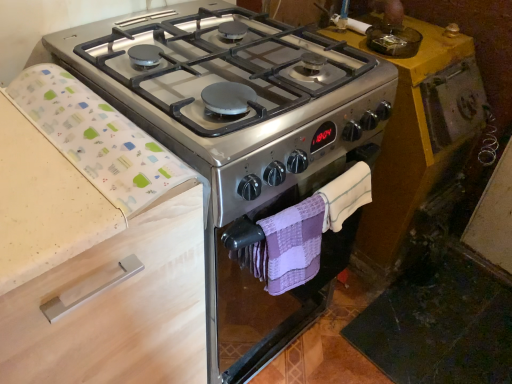
Identify the location of free location above white fabric at left (from a real-world perspective). (71, 100).